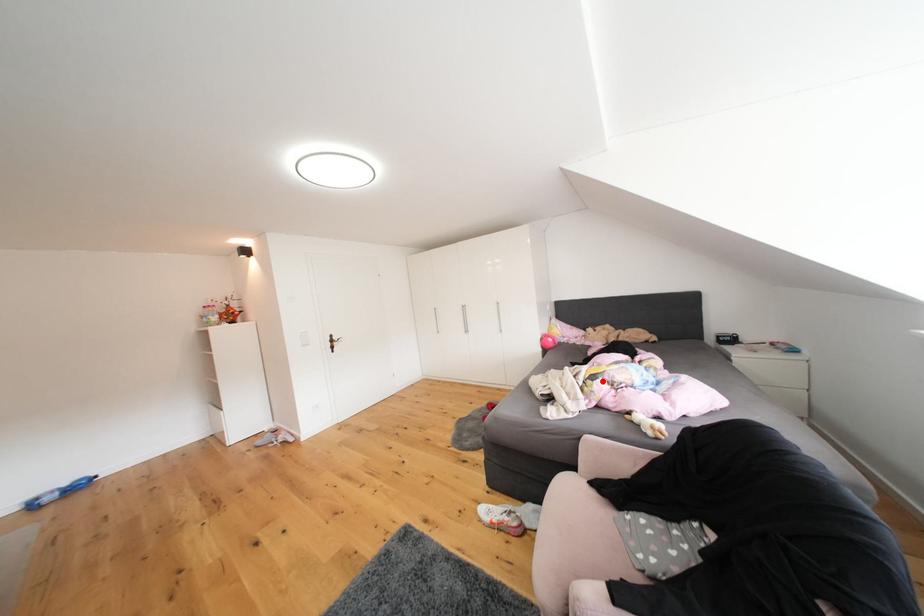
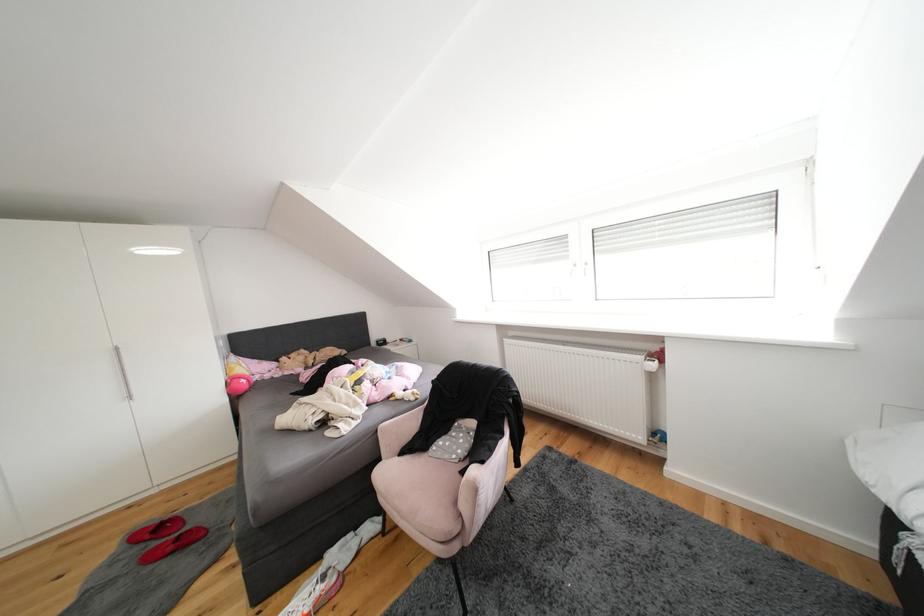
In the second image, find the point that corresponds to the highlighted location in the first image.

(368, 386)